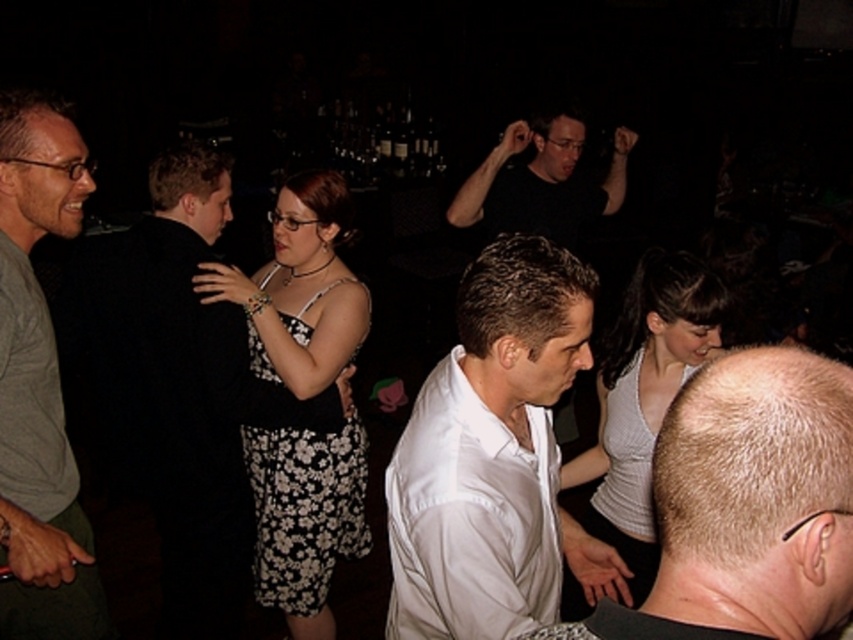
Is point (21, 305) closer to viewer compared to point (492, 204)?

That is True.

Which is behind, point (6, 218) or point (579, 220)?

The point (579, 220) is behind.

The height and width of the screenshot is (640, 853). I want to click on gray cotton shirt at left, so click(x=39, y=381).

Image resolution: width=853 pixels, height=640 pixels. Find the location of `white smooth shirt at center`. white smooth shirt at center is located at coordinates (750, 504).

Looking at this image, is the position of white smooth shirt at center more distant than that of gray cotton shirt at left?

No, white smooth shirt at center is in front of gray cotton shirt at left.

Who is more forward, (714,504) or (32,548)?

Positioned in front is point (714,504).

At what (x,y) coordinates should I click in order to perform the action: click on white smooth shirt at center. Please return your answer as a coordinate pair (x, y). This screenshot has width=853, height=640. Looking at the image, I should click on (750, 504).

Is black fabric shirt at left thinner than gray cotton shirt at left?

No, black fabric shirt at left is not thinner than gray cotton shirt at left.

Which of these two, black fabric shirt at left or gray cotton shirt at left, stands taller?

black fabric shirt at left

This screenshot has height=640, width=853. Find the location of `black fabric shirt at left`. black fabric shirt at left is located at coordinates (178, 387).

Find the location of a particular element. The width and height of the screenshot is (853, 640). black fabric shirt at left is located at coordinates (178, 387).